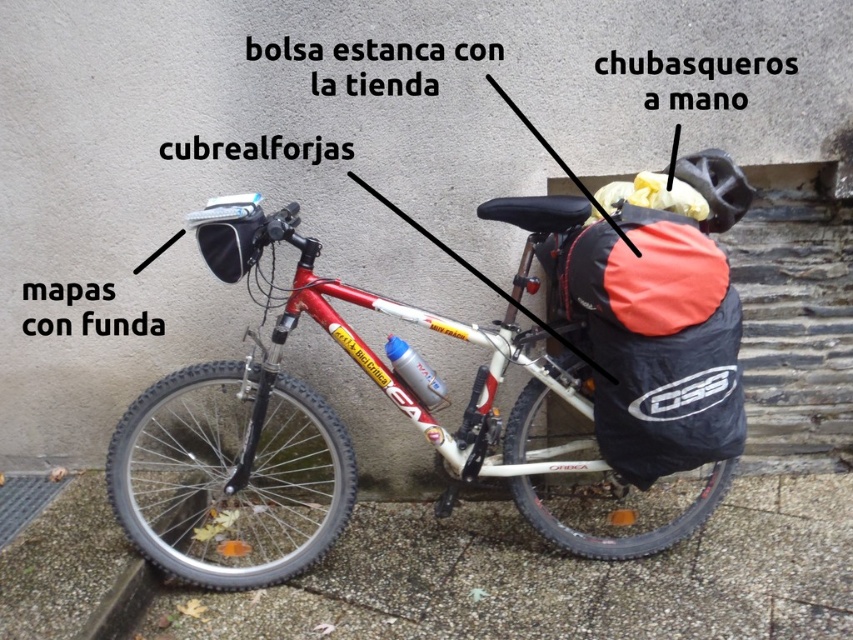
You are standing 10 feet away from the mountain bike. The Cubrealforjas is located at point (519, 198). Can you reach it without moving closer?

The distance of point (519, 198) from viewer is 7.31 feet. Since you are standing 10 feet away, the Cubrealforjas is farther than your current position, so you cannot reach it without moving closer.

You are standing at the origin point in the image. Where is the shiny metallic bicycle at center located in terms of coordinates?

The shiny metallic bicycle at center is located at coordinates point (344, 433).